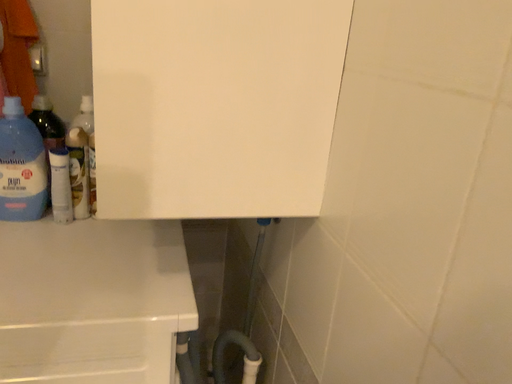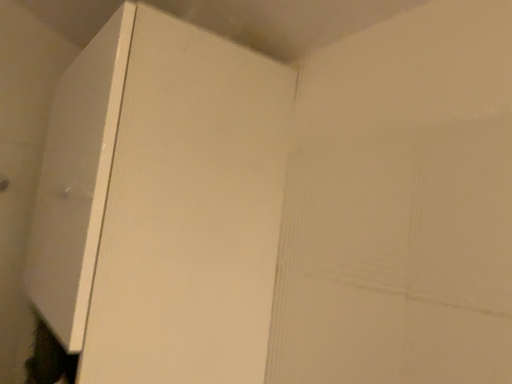
Question: How did the camera likely rotate when shooting the video?

Choices:
 (A) rotated left
 (B) rotated right

Answer: (B)